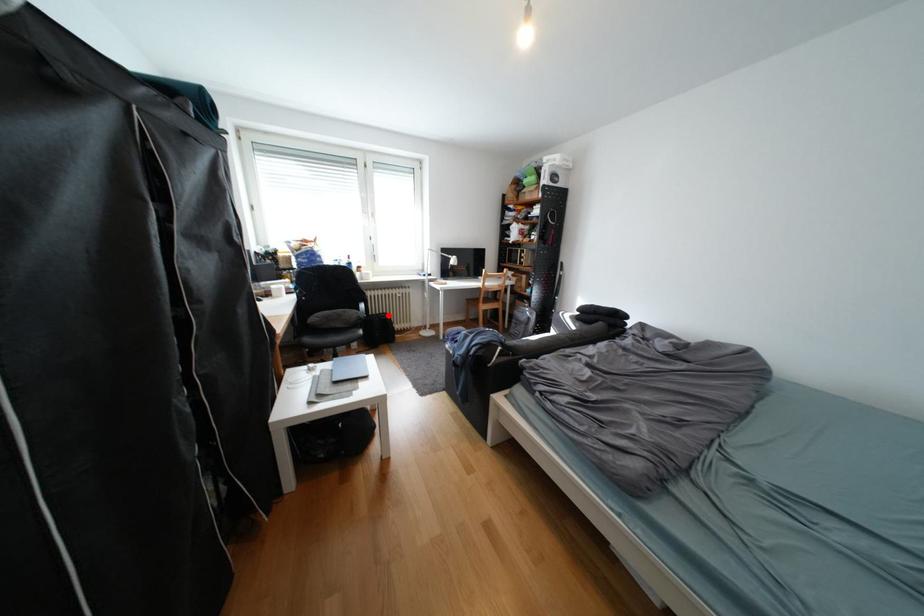
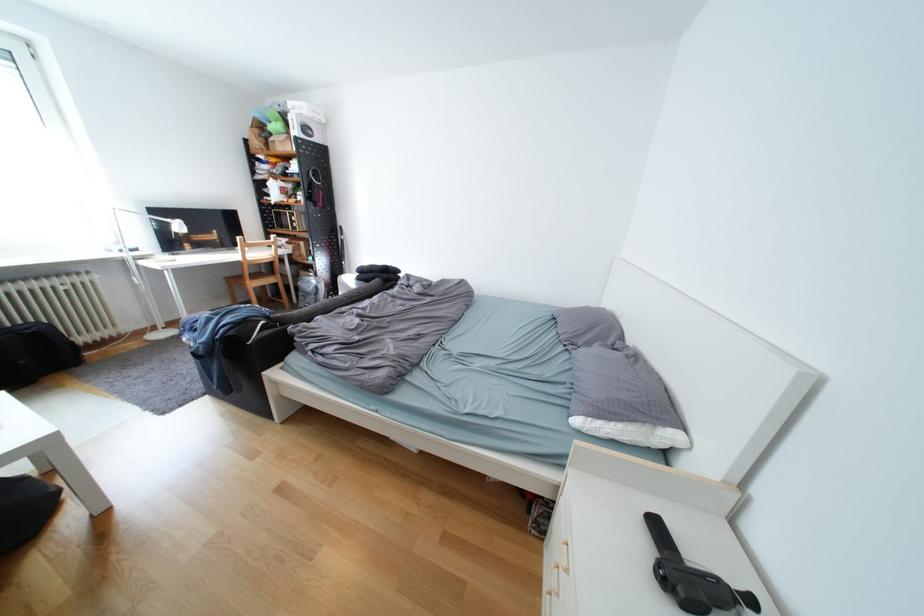
The point at the highlighted location is marked in the first image. Where is the corresponding point in the second image?

(14, 330)